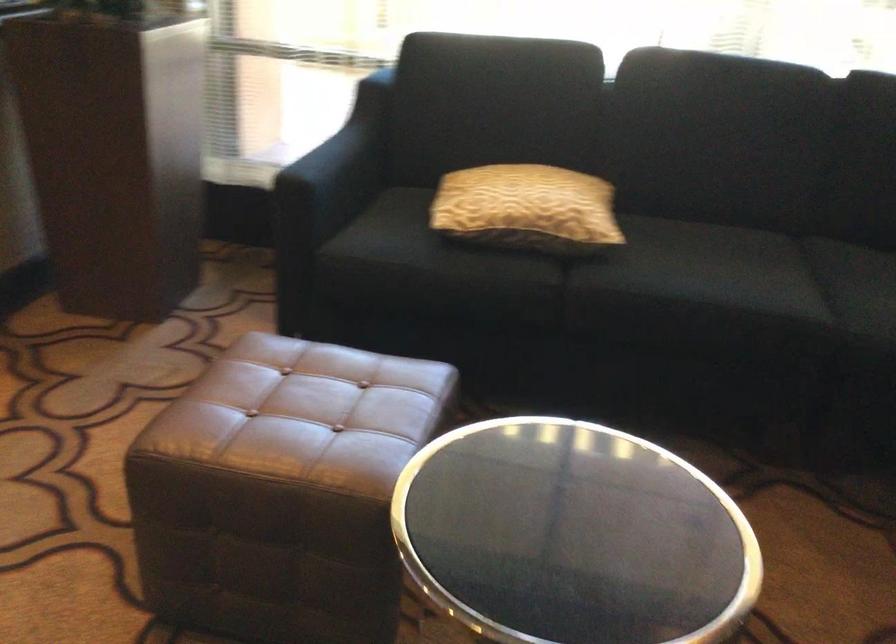
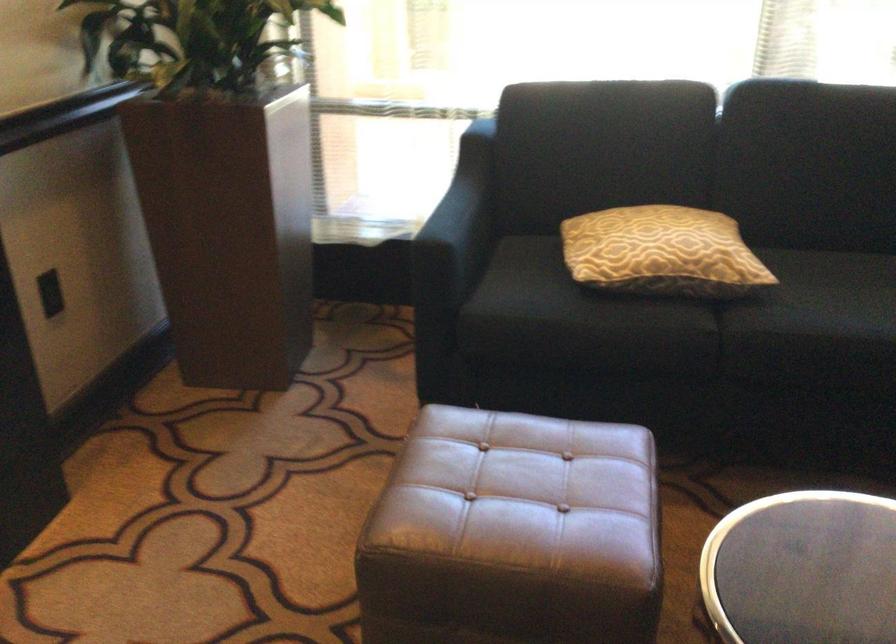
Where in the second image is the point corresponding to pixel 601 251 from the first image?

(752, 289)